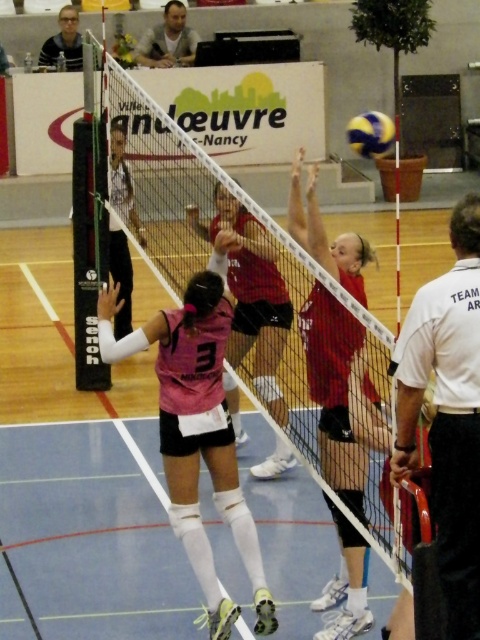
Question: Which point is farther from the camera taking this photo?

Choices:
 (A) (273, 326)
 (B) (440, 436)
 (C) (386, 145)
 (D) (204, 545)

Answer: (C)

Question: Is the position of white mesh net at center more distant than that of pink jersey at center?

Choices:
 (A) no
 (B) yes

Answer: (A)

Question: Among these objects, which one is nearest to the camera?

Choices:
 (A) white shirt at right
 (B) yellow matte volleyball at upper center
 (C) pink matte/vinyl jersey at center

Answer: (A)

Question: Is the position of white mesh net at center more distant than that of pink jersey at center?

Choices:
 (A) no
 (B) yes

Answer: (A)

Question: Which point is closer to the camera taking this photo?

Choices:
 (A) (336, 472)
 (B) (110, 134)
 (C) (252, 320)
 (D) (349, 120)

Answer: (A)

Question: Can you confirm if white shirt at right is bigger than pink jersey at center?

Choices:
 (A) no
 (B) yes

Answer: (A)